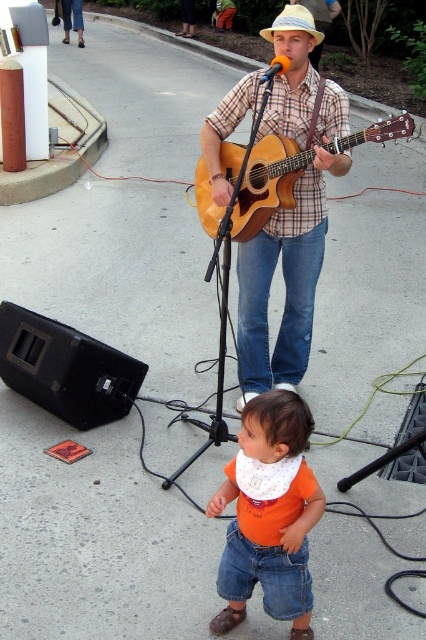
Is acoustic wood guitar at center shorter than orange matte microphone at upper center?

Yes, acoustic wood guitar at center is shorter than orange matte microphone at upper center.

Measure the distance from acoustic wood guitar at center to orange matte microphone at upper center.

acoustic wood guitar at center is 28.67 inches away from orange matte microphone at upper center.

You are a GUI agent. You are given a task and a screenshot of the screen. Output one action in this format:
    pyautogui.click(x=<x>, y=<y>)
    Task: Click on the acoustic wood guitar at center
    This screenshot has height=640, width=426.
    Given the screenshot: What is the action you would take?
    pyautogui.click(x=252, y=184)

Find the location of a particular element. The height and width of the screenshot is (640, 426). plaid shirt at center is located at coordinates 290,225.

Which of these two, plaid shirt at center or acoustic wood guitar at center, stands taller?

Standing taller between the two is plaid shirt at center.

Which is in front, point (313, 291) or point (199, 182)?

Positioned in front is point (313, 291).

The height and width of the screenshot is (640, 426). I want to click on plaid shirt at center, so 290,225.

Is point (294, 76) closer to camera compared to point (276, 17)?

Yes.

Which is more to the left, plaid shirt at center or light beige straw cowboy hat at center?

plaid shirt at center

Between point (276, 259) and point (304, 26), which one is positioned in front?

Point (304, 26) is in front.

Find the location of `plaid shirt at center`. plaid shirt at center is located at coordinates (290, 225).